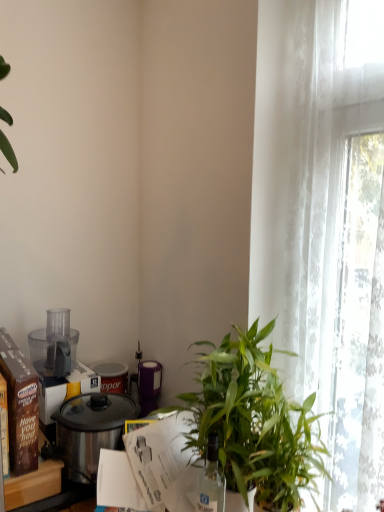
Question: Is shiny metallic pot at lower left further to the viewer compared to transparent plastic food processor at left?

Choices:
 (A) yes
 (B) no

Answer: (B)

Question: Considering the relative positions of shiny metallic pot at lower left and transparent plastic food processor at left in the image provided, is shiny metallic pot at lower left in front of transparent plastic food processor at left?

Choices:
 (A) yes
 (B) no

Answer: (A)

Question: Does shiny metallic pot at lower left have a larger size compared to transparent plastic food processor at left?

Choices:
 (A) no
 (B) yes

Answer: (B)

Question: Can you confirm if shiny metallic pot at lower left is smaller than transparent plastic food processor at left?

Choices:
 (A) no
 (B) yes

Answer: (A)

Question: From the image's perspective, is shiny metallic pot at lower left above transparent plastic food processor at left?

Choices:
 (A) no
 (B) yes

Answer: (A)

Question: Considering the relative sizes of shiny metallic pot at lower left and transparent plastic food processor at left in the image provided, is shiny metallic pot at lower left wider than transparent plastic food processor at left?

Choices:
 (A) no
 (B) yes

Answer: (A)

Question: Does transparent plastic food processor at left have a lesser height compared to brown cardboard box at left?

Choices:
 (A) no
 (B) yes

Answer: (A)

Question: From a real-world perspective, does transparent plastic food processor at left sit lower than brown cardboard box at left?

Choices:
 (A) no
 (B) yes

Answer: (A)

Question: Is brown cardboard box at left surrounded by transparent plastic food processor at left?

Choices:
 (A) yes
 (B) no

Answer: (B)

Question: Is transparent plastic food processor at left oriented away from brown cardboard box at left?

Choices:
 (A) no
 (B) yes

Answer: (A)

Question: From the image's perspective, is transparent plastic food processor at left below brown cardboard box at left?

Choices:
 (A) no
 (B) yes

Answer: (A)

Question: Does transparent plastic food processor at left touch brown cardboard box at left?

Choices:
 (A) yes
 (B) no

Answer: (B)

Question: Considering the relative sizes of brown cardboard box at left and shiny metallic pot at lower left in the image provided, is brown cardboard box at left smaller than shiny metallic pot at lower left?

Choices:
 (A) yes
 (B) no

Answer: (A)